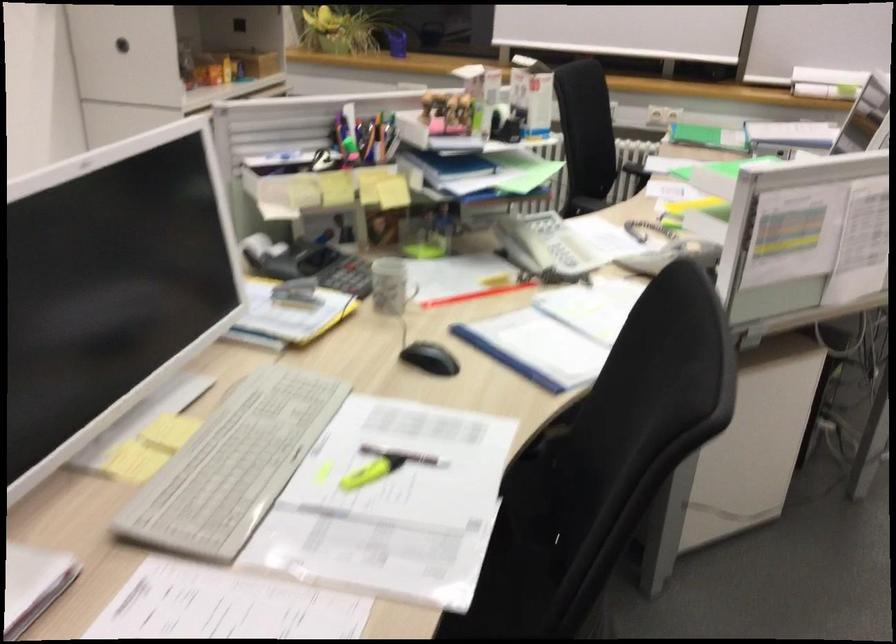
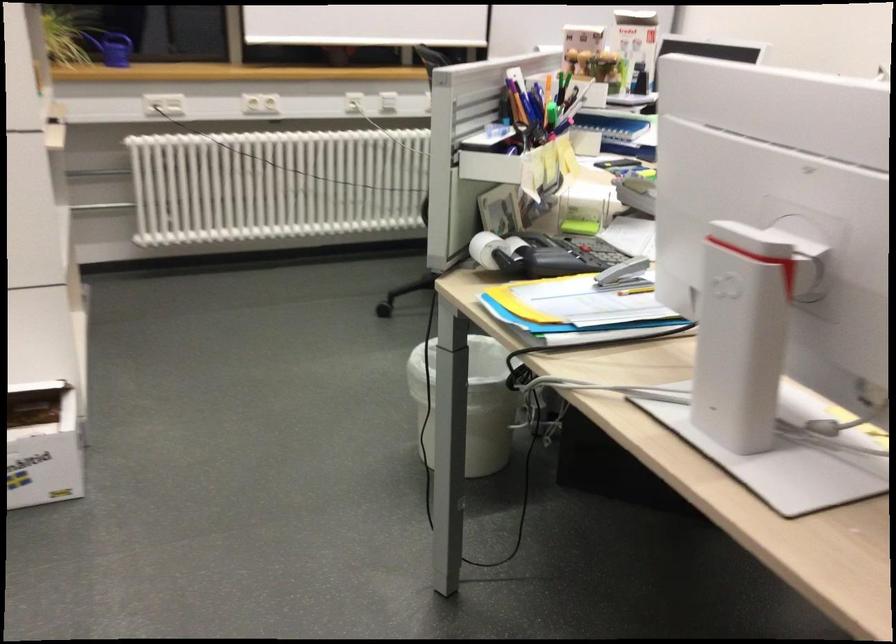
Where in the second image is the point corresponding to the point at 341,140 from the first image?

(521, 104)